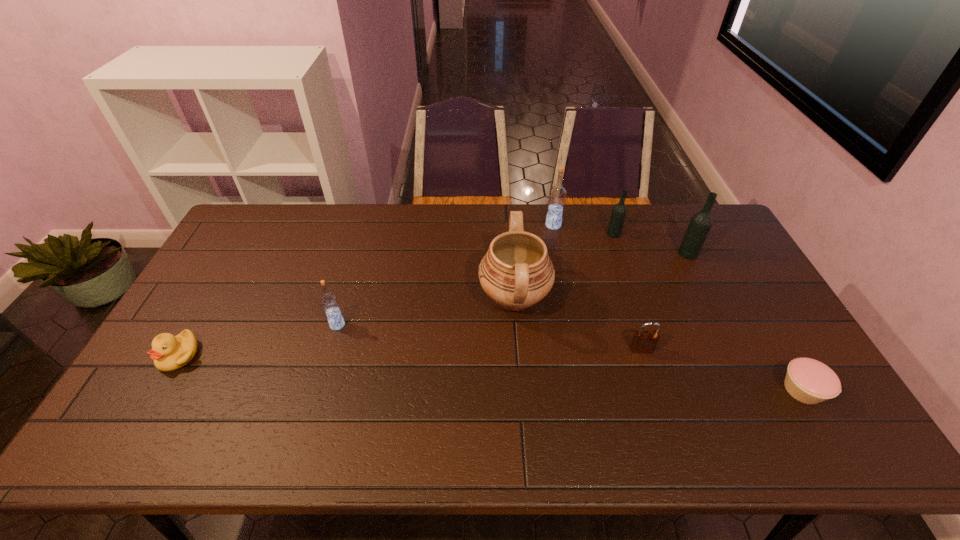
Find the location of a particular element. The height and width of the screenshot is (540, 960). free space between the third farthest object and the urn is located at coordinates (601, 275).

Where is `free space between the shortest object and the farther black vodka`? Image resolution: width=960 pixels, height=540 pixels. free space between the shortest object and the farther black vodka is located at coordinates (708, 312).

Locate an element on the screen. This screenshot has width=960, height=540. vacant space that's between the yellow duckling and the farther black vodka is located at coordinates (396, 294).

This screenshot has width=960, height=540. Find the location of `object that stands as the sixth closest to the urn`. object that stands as the sixth closest to the urn is located at coordinates (807, 380).

Where is `object that ranks as the closest to the brown padlock`? The image size is (960, 540). object that ranks as the closest to the brown padlock is located at coordinates (516, 272).

Identify which vodka is the third closest to the seventh tallest object. Please provide its 2D coordinates. Your answer should be formatted as a tuple, i.e. [(x, y)], where the tuple contains the x and y coordinates of a point satisfying the conditions above.

[(619, 211)]

I want to click on vodka that is the third closest to the leftmost object, so click(x=619, y=211).

Image resolution: width=960 pixels, height=540 pixels. Find the location of `vacant space that satisfies the following two spatial constraints: 1. on the front-facing side of the sixth object from right to left; 2. on the front-facing side of the leftmost object`. vacant space that satisfies the following two spatial constraints: 1. on the front-facing side of the sixth object from right to left; 2. on the front-facing side of the leftmost object is located at coordinates (518, 355).

Identify the location of vacant space that satisfies the following two spatial constraints: 1. on the front-facing side of the third object from left to right; 2. on the front-facing side of the duckling. (518, 355).

Identify the location of blank space that satisfies the following two spatial constraints: 1. on the front-facing side of the cupcake; 2. on the left side of the seventh tallest object. Image resolution: width=960 pixels, height=540 pixels. (158, 390).